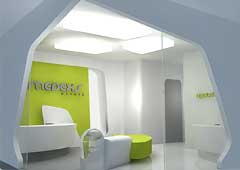
This screenshot has height=170, width=240. In order to click on lime green furniture item in this screenshot , I will do `click(138, 150)`.